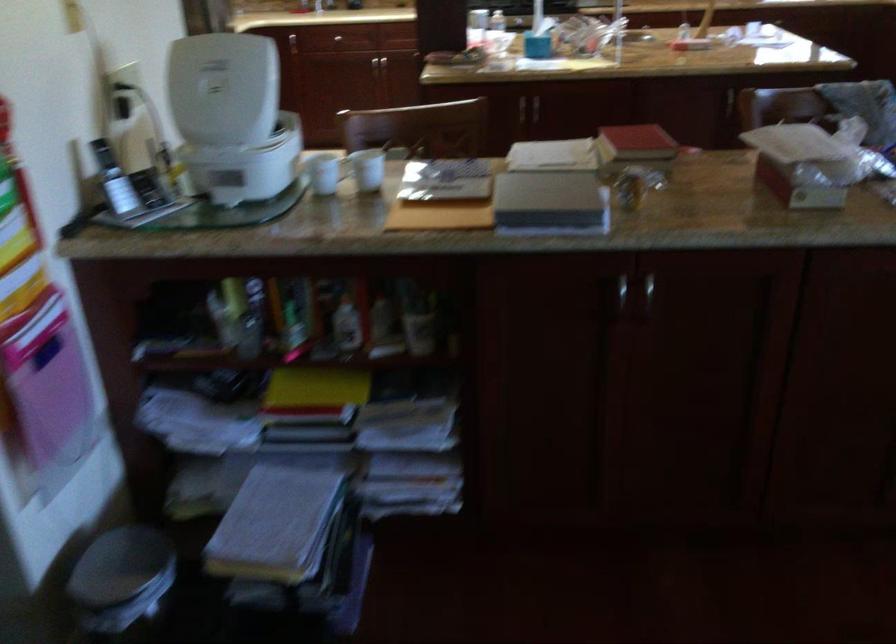
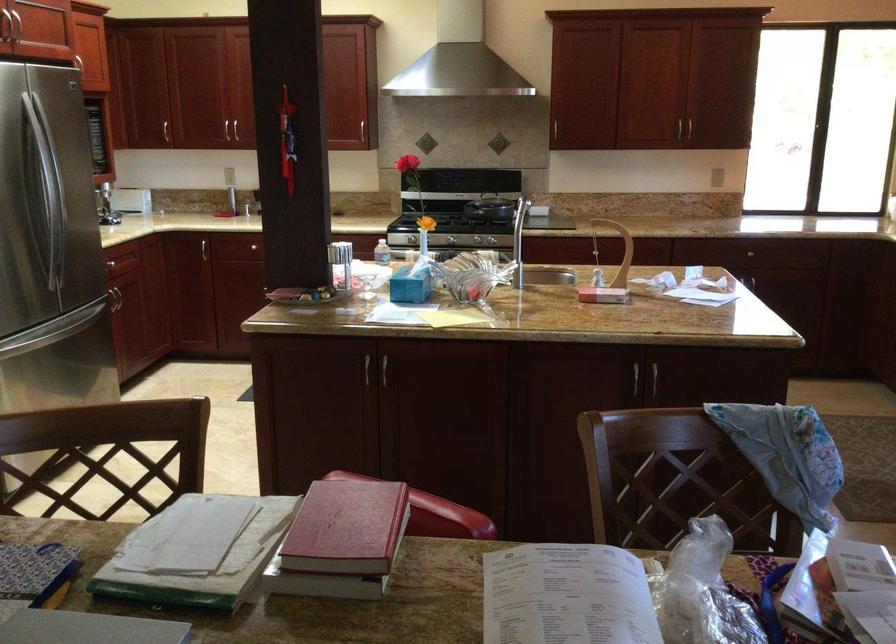
In the second image, find the point that corresponds to point (676, 126) in the first image.

(535, 404)